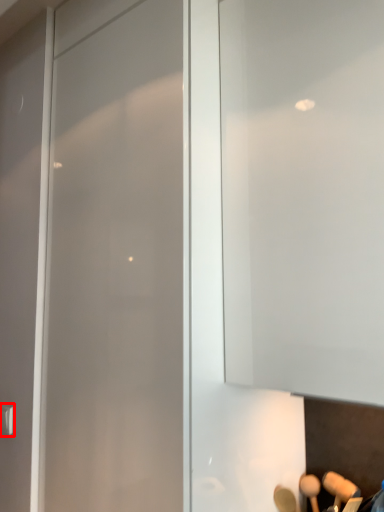
Question: From the image's perspective, what is the correct spatial positioning of door handle (annotated by the red box) in reference to glass door?

Choices:
 (A) below
 (B) above

Answer: (A)